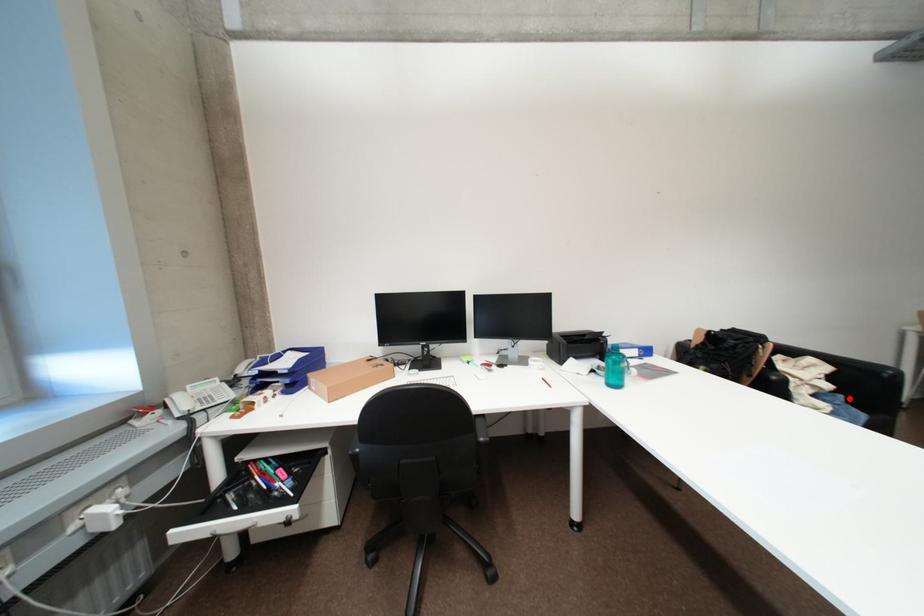
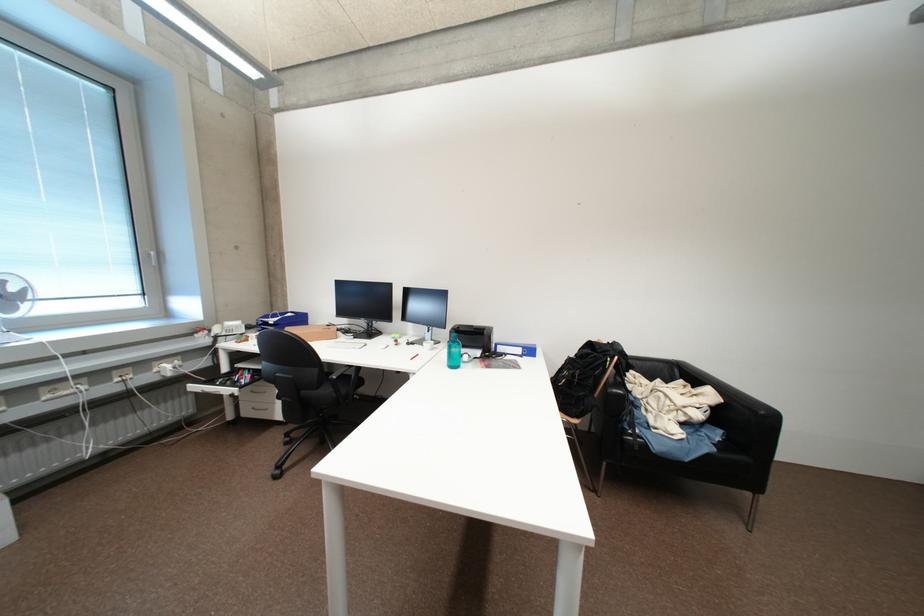
Question: I am providing you with two images of the same scene from different viewpoints. A red point is marked on the first image. Is the red point's position out of view in image 2?

Choices:
 (A) Yes
 (B) No

Answer: (B)